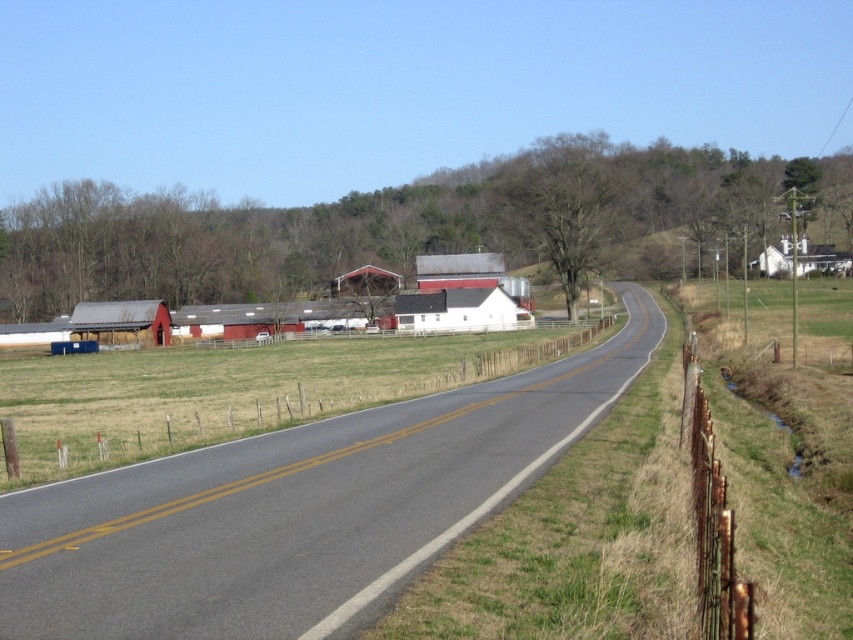
Question: Estimate the real-world distances between objects in this image. Which object is farther from the rustic wood barn at center?

Choices:
 (A) matte red barn at left
 (B) white matte house at upper right

Answer: (B)

Question: Can you confirm if matte red barn at left is positioned to the right of rustic wood barn at center?

Choices:
 (A) yes
 (B) no

Answer: (B)

Question: Which of the following is the farthest from the observer?

Choices:
 (A) matte red barn at left
 (B) white matte house at upper right

Answer: (B)

Question: Can you confirm if matte red barn at left is positioned to the right of rustic wood barn at center?

Choices:
 (A) yes
 (B) no

Answer: (B)

Question: Can you confirm if matte red barn at left is positioned below rustic wood barn at center?

Choices:
 (A) yes
 (B) no

Answer: (A)

Question: Among these objects, which one is nearest to the camera?

Choices:
 (A) matte red barn at left
 (B) white matte house at upper right
 (C) red barn at center
 (D) rustic wood barn at center

Answer: (C)